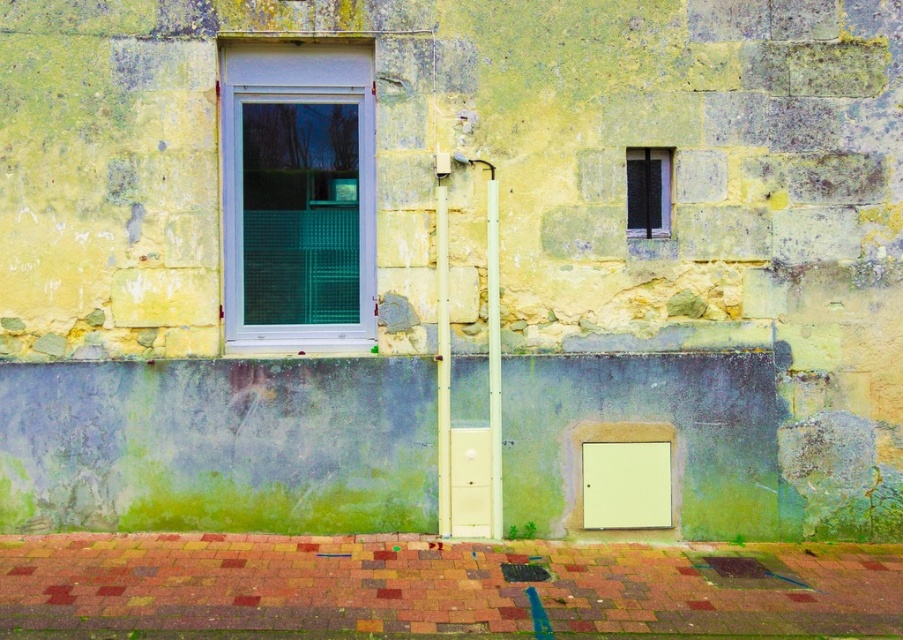
Is the position of white plastic window at center more distant than that of white plastic pipe at center?

Yes, it is behind white plastic pipe at center.

Is point (253, 323) positioned in front of point (492, 426)?

No, (253, 323) is further to viewer.

The width and height of the screenshot is (903, 640). I want to click on white plastic window at center, so click(x=296, y=195).

Who is higher up, white plastic pole at center or black metal window at upper right?

Positioned higher is black metal window at upper right.

The image size is (903, 640). What do you see at coordinates (442, 349) in the screenshot?
I see `white plastic pole at center` at bounding box center [442, 349].

Where is `white plastic pole at center`? white plastic pole at center is located at coordinates (442, 349).

Does white plastic pipe at center have a lesser height compared to black metal window at upper right?

No, white plastic pipe at center is not shorter than black metal window at upper right.

Is white plastic pipe at center bigger than black metal window at upper right?

Actually, white plastic pipe at center might be smaller than black metal window at upper right.

The height and width of the screenshot is (640, 903). Find the location of `white plastic pipe at center`. white plastic pipe at center is located at coordinates 492,353.

I want to click on white plastic pipe at center, so click(x=492, y=353).